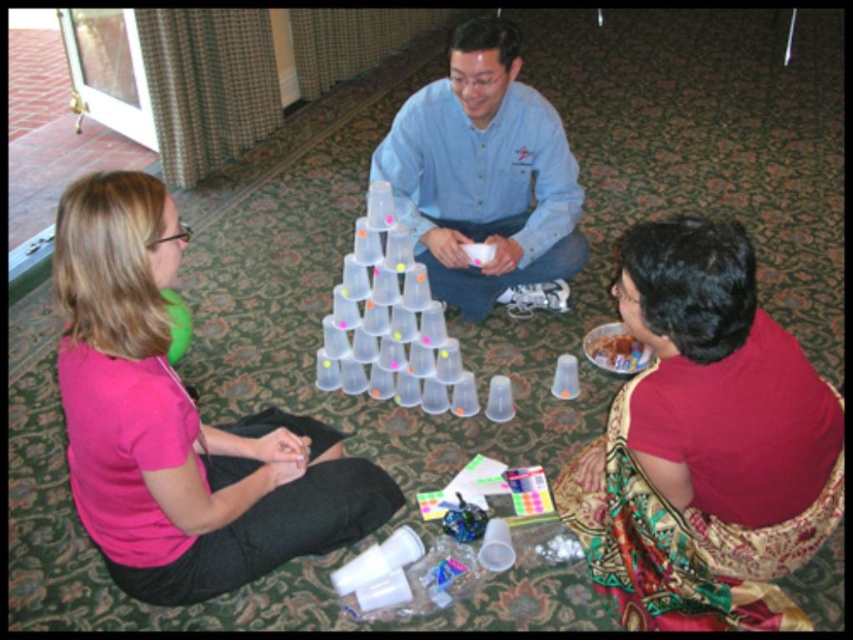
Consider the image. You are organizing a group photo and need to arrange the participants by their clothing size from smallest to largest. Given the pink matte shirt at left and the denim shirt at center, which order should they be placed in?

The pink matte shirt at left is smaller than the denim shirt at center, so they should be arranged with the pink matte shirt at left first, followed by the denim shirt at center.

You are standing at point point (782, 381) and want to take a photo of the pyramid of plastic cups. The camera you have can only focus on objects within 1.5 meters. Will the camera be able to focus on the pyramid?

The point (782, 381) and camera are 1.38 meters apart from each other. Since the camera can focus within 1.5 meters, the distance of 1.38 meters is within the range. Therefore, the camera can focus on the pyramid.